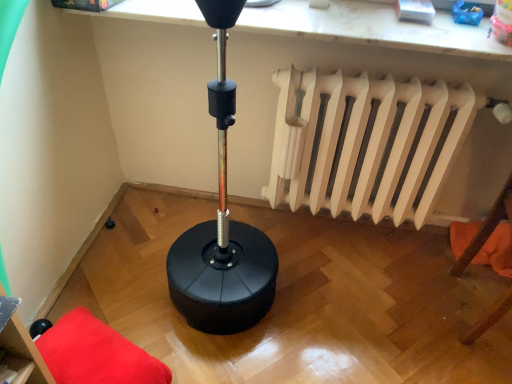
Question: Do you think orange fabric pillow at lower right is within black rubber punching bag at upper center, or outside of it?

Choices:
 (A) outside
 (B) inside

Answer: (A)

Question: In terms of height, does orange fabric pillow at lower right look taller or shorter compared to black rubber punching bag at upper center?

Choices:
 (A) tall
 (B) short

Answer: (A)

Question: Estimate the real-world distances between objects in this image. Which object is farther from the velvet red cushion at lower left, which is the second furniture from front to back?

Choices:
 (A) white matte radiator at upper right
 (B) matte black stool at lower left, marked as the 2th furniture in a bottom-to-top arrangement
 (C) orange fabric pillow at lower right
 (D) black rubber punching bag at upper center

Answer: (C)

Question: Which object is the closest to the black rubber punching bag at upper center?

Choices:
 (A) orange fabric pillow at lower right
 (B) matte black stool at lower left, the 1th furniture positioned from the top
 (C) velvet red cushion at lower left, positioned as the 1th furniture in bottom-to-top order
 (D) white matte radiator at upper right

Answer: (D)